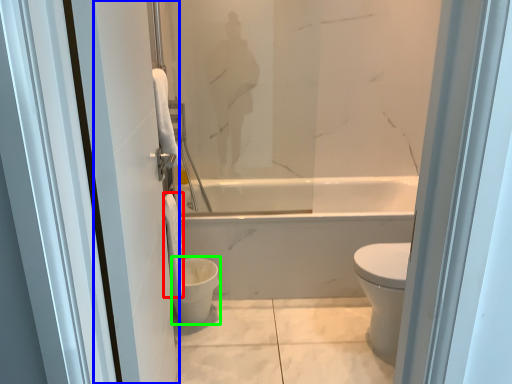
Question: Which object is the closest to the toilet paper (highlighted by a red box)? Choose among these: screen door (highlighted by a blue box) or toilet bowl (highlighted by a green box).

Choices:
 (A) screen door
 (B) toilet bowl

Answer: (B)